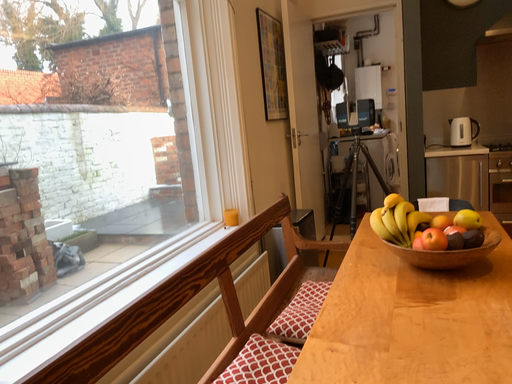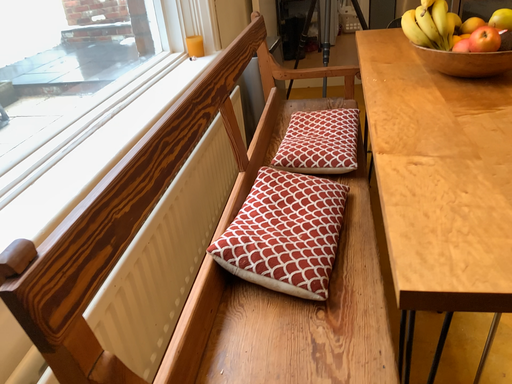
Question: Which way did the camera rotate in the video?

Choices:
 (A) rotated right
 (B) rotated left

Answer: (A)